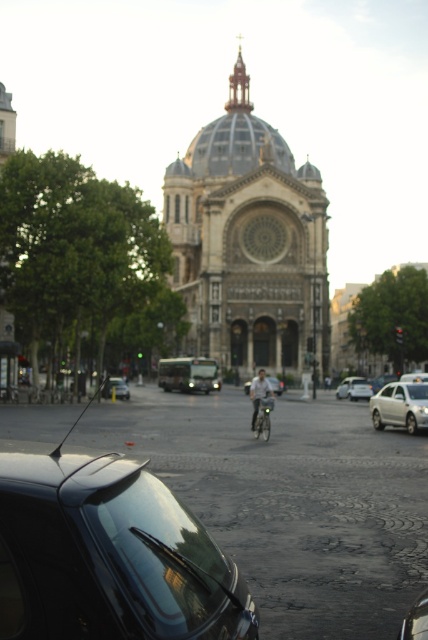
Question: Among these objects, which one is farthest from the camera?

Choices:
 (A) shiny black car at lower right
 (B) gray stone cathedral at center
 (C) shiny silver bicycle at center
 (D) silver metallic sedan at right

Answer: (B)

Question: Which point is farther to the camera?

Choices:
 (A) shiny silver bicycle at center
 (B) shiny black car at center
 (C) metallic silver bicycle at center

Answer: (C)

Question: Which point is closer to the camera?

Choices:
 (A) shiny black car at center
 (B) light gray fabric bicycle at center
 (C) silver metallic sedan at right

Answer: (A)

Question: Considering the relative positions of light gray fabric bicycle at center and metallic silver car at center in the image provided, where is light gray fabric bicycle at center located with respect to metallic silver car at center?

Choices:
 (A) below
 (B) above

Answer: (B)

Question: In this image, where is light gray fabric bicycle at center located relative to metallic silver bicycle at center?

Choices:
 (A) above
 (B) below

Answer: (B)

Question: Can you confirm if gray stone cathedral at center is bigger than metallic silver bicycle at center?

Choices:
 (A) yes
 (B) no

Answer: (A)